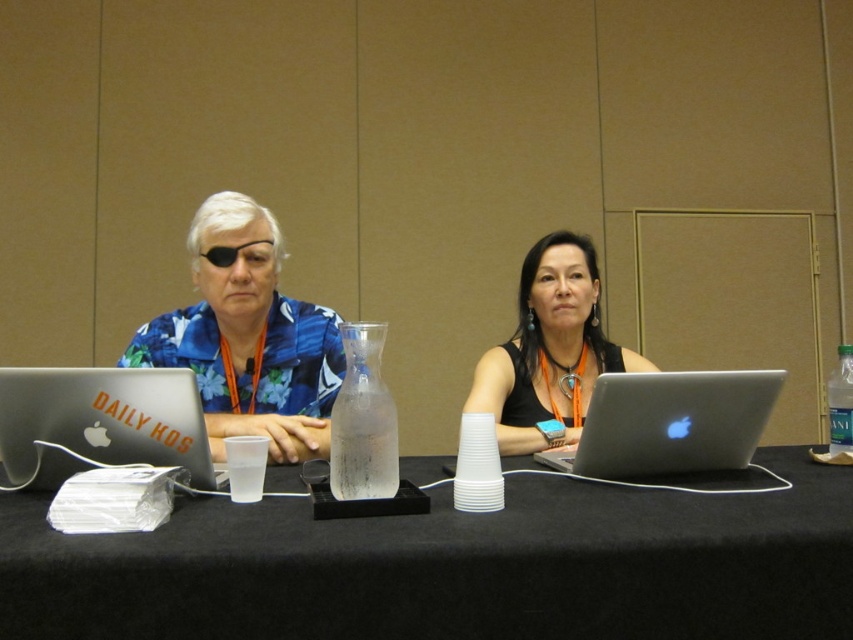
You are organizing a meeting and need to place a new document on the table between the matte silver laptop at left and the black matte laptop at center. Which laptop should you place it closer to if you want the document to be closer to the left side of the table?

You should place the document closer to the matte silver laptop at left because it is already positioned to the left of the black matte laptop at center, so placing the document near it will keep it closer to the left side of the table.

You are a conference attendee who needs to reach for the clear glass bottle at right to get water. However, you must avoid touching the matte silver laptop at left. Based on the scene, is the bottle positioned in a way that allows you to reach it without disturbing the laptop?

The matte silver laptop at left is located below the clear glass bottle at right, so the bottle is above the laptop. This means you can reach for the bottle without disturbing the laptop as it is positioned higher up.

You are organizing a meeting and need to place a 2.5 inch tall paperweight on the table. The black matte laptop at center and the clear glass bottle at right are already there. Which object can the paperweight be placed on top of without being obstructed?

The black matte laptop at center has a greater height compared to the clear glass bottle at right, so the paperweight can be placed on top of the black matte laptop at center without obstruction.